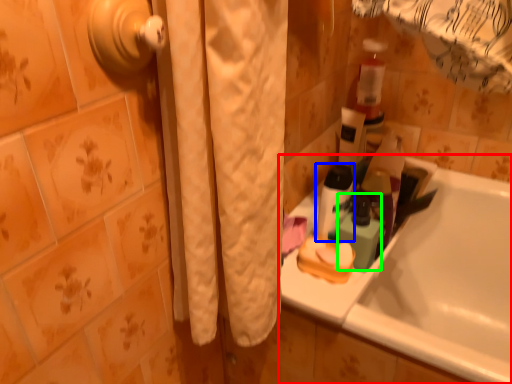
Question: Which is nearer to the bathtub (highlighted by a red box)? toiletry (highlighted by a blue box) or mouthwash (highlighted by a green box).

Choices:
 (A) toiletry
 (B) mouthwash

Answer: (B)